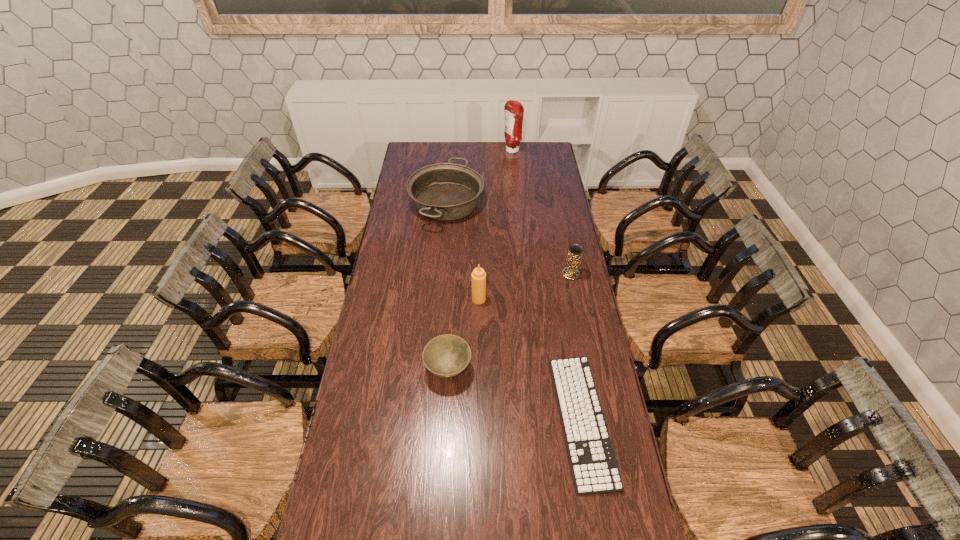
Find the location of a particular element. the tallest object is located at coordinates (513, 110).

This screenshot has width=960, height=540. Find the location of `the farthest object`. the farthest object is located at coordinates 513,110.

I want to click on the fifth shortest object, so click(478, 276).

Identify the location of the nearer condiment. The width and height of the screenshot is (960, 540). (478, 276).

The width and height of the screenshot is (960, 540). What are the coordinates of `chalice` in the screenshot? It's located at (575, 250).

You are a GUI agent. You are given a task and a screenshot of the screen. Output one action in this format:
    pyautogui.click(x=<x>, y=<y>)
    Task: Click on the fourth shortest object
    
    Given the screenshot: What is the action you would take?
    pyautogui.click(x=575, y=250)

Find the location of `the fifth nearest object`. the fifth nearest object is located at coordinates (445, 191).

Find the location of a particular element. pan is located at coordinates (445, 191).

Locate an element on the screen. Image resolution: width=960 pixels, height=540 pixels. bowl is located at coordinates (447, 355).

The image size is (960, 540). I want to click on the shortest object, so click(x=594, y=469).